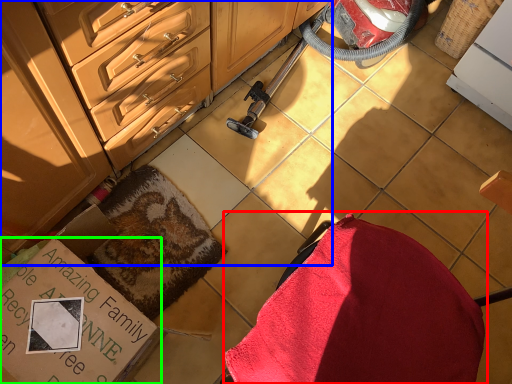
Question: Which object is positioned closest to swivel chair (highlighted by a red box)? Select from cabinetry (highlighted by a blue box) and cardboard box (highlighted by a green box).

Choices:
 (A) cabinetry
 (B) cardboard box

Answer: (B)